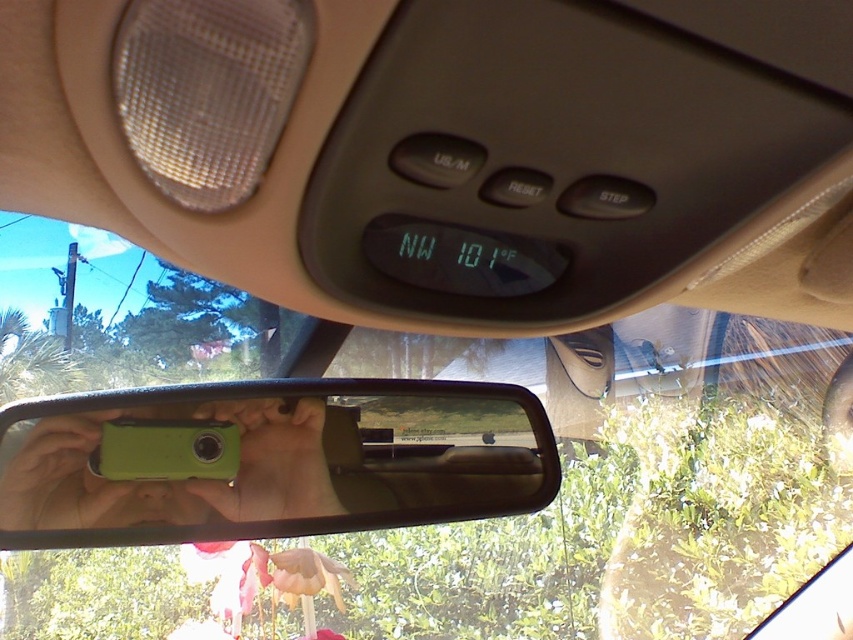
Question: Does green plastic phone at center appear on the left side of green matte phone at center?

Choices:
 (A) no
 (B) yes

Answer: (A)

Question: Which object is closer to the camera taking this photo?

Choices:
 (A) green matte phone at center
 (B) green plastic phone at center

Answer: (B)

Question: Which point appears farthest from the camera in this image?

Choices:
 (A) (105, 397)
 (B) (177, 524)

Answer: (B)

Question: Can you confirm if green plastic phone at center is positioned to the left of green matte phone at center?

Choices:
 (A) no
 (B) yes

Answer: (A)

Question: Can you confirm if green plastic phone at center is thinner than green matte phone at center?

Choices:
 (A) no
 (B) yes

Answer: (A)